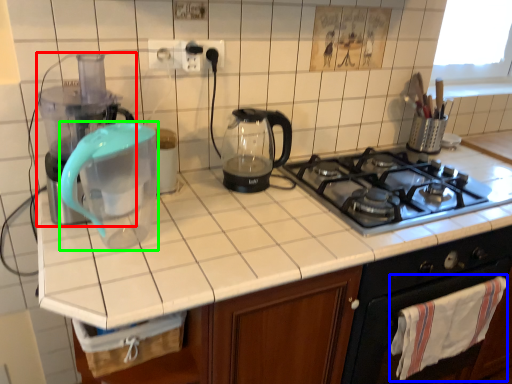
Question: Based on their relative distances, which object is farther from blender (highlighted by a red box)? Choose from cloth (highlighted by a blue box) and coffeepot (highlighted by a green box).

Choices:
 (A) cloth
 (B) coffeepot

Answer: (A)